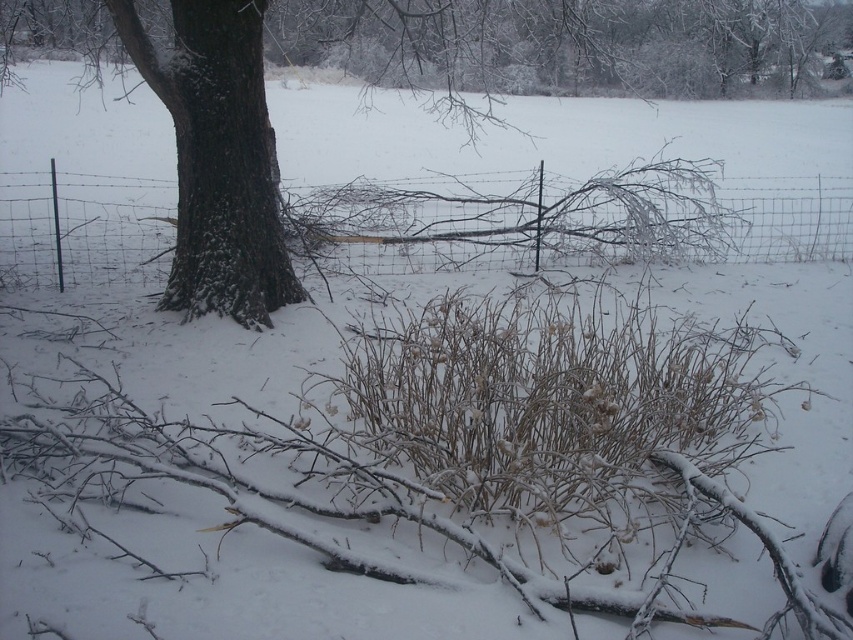
You are a farmer checking the boundaries of your property. You notice the wire mesh fence at center and the brown rough bark tree at center. Which one has a greater width?

The wire mesh fence at center has a greater width than the brown rough bark tree at center according to the description.

You are a bird looking for a place to perch. You see the wire mesh fence at center and the brown rough bark tree at center. Which one is taller and can provide a higher vantage point?

The wire mesh fence at center is taller than the brown rough bark tree at center, so it can provide a higher vantage point for the bird.